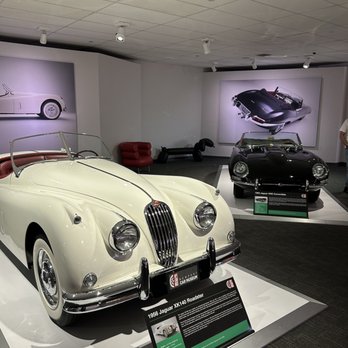
Identify the location of chair. (137, 149).